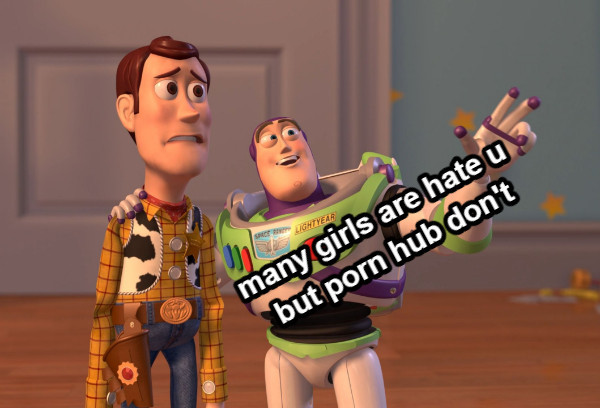
Find the location of `flooring`. flooring is located at coordinates (445, 348), (36, 345), (240, 345).